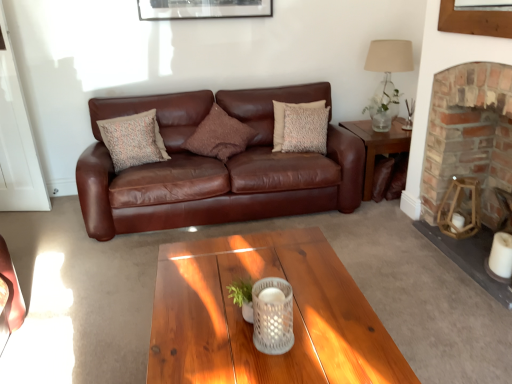
Question: Is brown leather couch at center positioned far away from wooden side table at right?

Choices:
 (A) no
 (B) yes

Answer: (A)

Question: Are brown leather couch at center and wooden side table at right making contact?

Choices:
 (A) no
 (B) yes

Answer: (A)

Question: Is brown leather couch at center shorter than wooden side table at right?

Choices:
 (A) no
 (B) yes

Answer: (A)

Question: From a real-world perspective, is brown leather couch at center over wooden side table at right?

Choices:
 (A) no
 (B) yes

Answer: (B)

Question: Is brown leather couch at center not within wooden side table at right?

Choices:
 (A) yes
 (B) no

Answer: (A)

Question: From the image's perspective, is wooden side table at right positioned above or below textured beige pillow at center, positioned as the third pillow in right-to-left order?

Choices:
 (A) below
 (B) above

Answer: (A)

Question: Considering their positions, is wooden side table at right located in front of or behind textured beige pillow at center, positioned as the third pillow in right-to-left order?

Choices:
 (A) behind
 (B) front

Answer: (A)

Question: From a real-world perspective, is wooden side table at right above or below textured beige pillow at center, placed as the 1th pillow when sorted from left to right?

Choices:
 (A) above
 (B) below

Answer: (B)

Question: Considering the positions of wooden side table at right and textured beige pillow at center, placed as the 1th pillow when sorted from left to right, in the image, is wooden side table at right wider or thinner than textured beige pillow at center, placed as the 1th pillow when sorted from left to right,?

Choices:
 (A) wide
 (B) thin

Answer: (A)

Question: Considering the positions of brown textured pillow at center, placed as the 2th pillow when sorted from left to right, and brick fireplace at right in the image, is brown textured pillow at center, placed as the 2th pillow when sorted from left to right, bigger or smaller than brick fireplace at right?

Choices:
 (A) small
 (B) big

Answer: (A)

Question: Considering the positions of brown textured pillow at center, placed as the 2th pillow when sorted from left to right, and brick fireplace at right in the image, is brown textured pillow at center, placed as the 2th pillow when sorted from left to right, taller or shorter than brick fireplace at right?

Choices:
 (A) short
 (B) tall

Answer: (A)

Question: Is point (232, 148) positioned closer to the camera than point (501, 153)?

Choices:
 (A) farther
 (B) closer

Answer: (A)

Question: Is brown textured pillow at center, positioned as the second pillow in right-to-left order, in front of or behind brick fireplace at right in the image?

Choices:
 (A) front
 (B) behind

Answer: (B)

Question: From the image's perspective, is textured beige pillow at center, positioned as the third pillow in right-to-left order, located above or below translucent glass lamp at upper right?

Choices:
 (A) above
 (B) below

Answer: (B)

Question: Looking at the image, does textured beige pillow at center, placed as the 1th pillow when sorted from left to right, seem bigger or smaller compared to translucent glass lamp at upper right?

Choices:
 (A) big
 (B) small

Answer: (B)